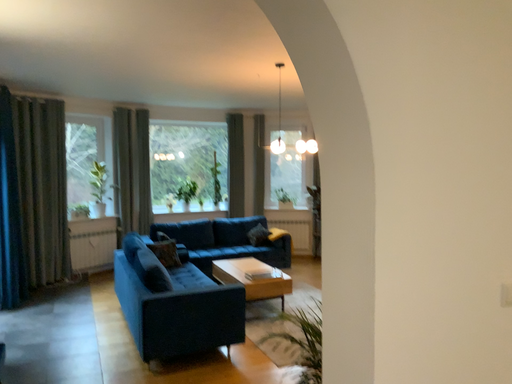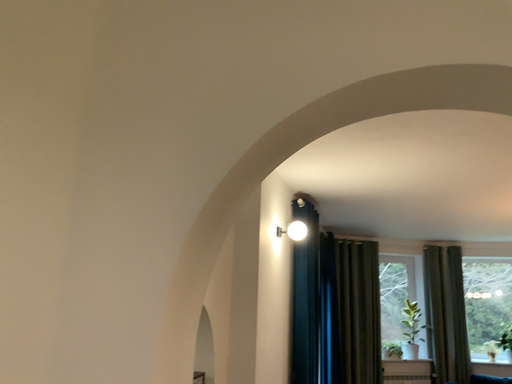
Question: Which way did the camera rotate in the video?

Choices:
 (A) rotated downward
 (B) rotated upward

Answer: (B)